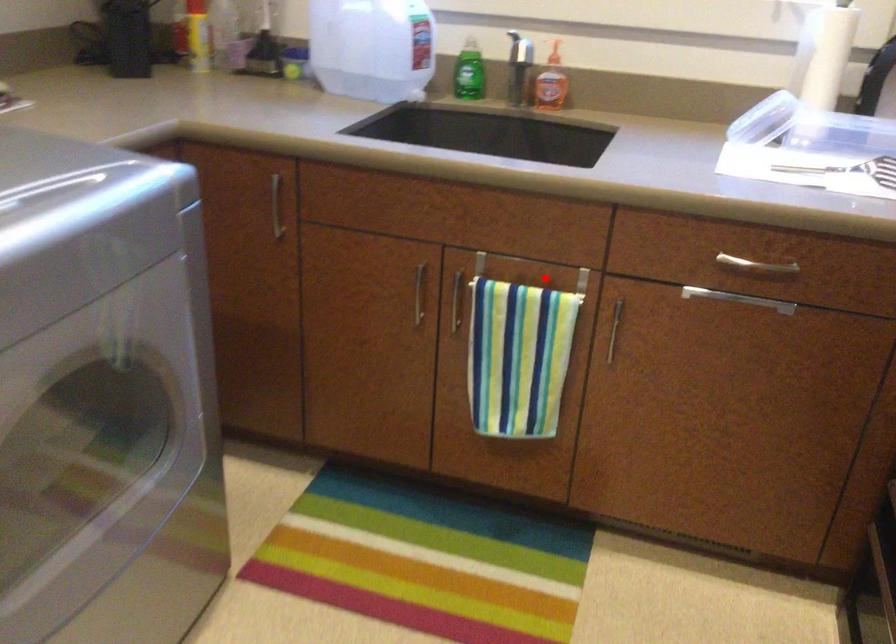
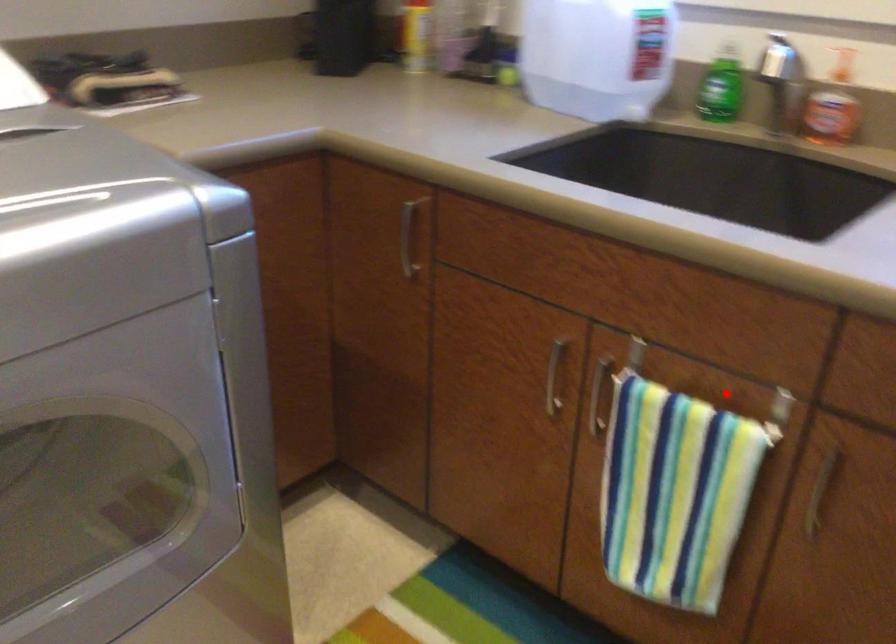
In the scene shown: I am providing you with two images of the same scene from different viewpoints. A red point is marked on the first image and another point is marked on the second image. Are the points marked in image1 and image2 representing the same 3D position?

Yes